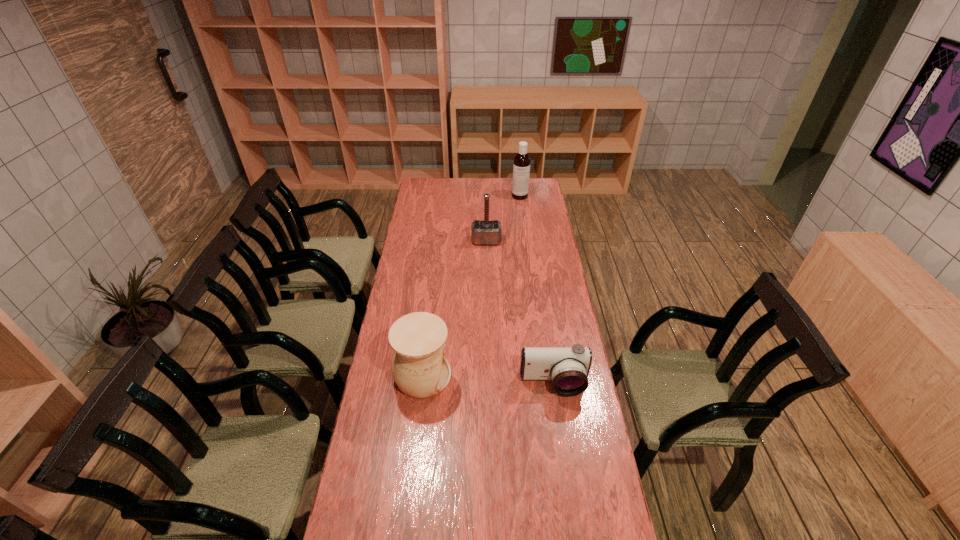
You are a GUI agent. You are given a task and a screenshot of the screen. Output one action in this format:
    pyautogui.click(x=<x>, y=<y>)
    Task: Click on the dishwasher detergent
    Image resolution: width=960 pixels, height=540 pixels.
    Given the screenshot: What is the action you would take?
    pyautogui.click(x=521, y=168)

Locate an element on the screen. The width and height of the screenshot is (960, 540). the farthest object is located at coordinates (521, 168).

Where is `hammer`? hammer is located at coordinates (485, 232).

Locate an element on the screen. This screenshot has height=540, width=960. the third object from right to left is located at coordinates (485, 232).

Find the location of a particular element. The image size is (960, 540). pottery is located at coordinates (420, 368).

Locate an element on the screen. the third tallest object is located at coordinates (420, 368).

Locate an element on the screen. This screenshot has height=540, width=960. camcorder is located at coordinates (568, 367).

Where is `free space located on the label side of the tallest object`? The height and width of the screenshot is (540, 960). free space located on the label side of the tallest object is located at coordinates (524, 226).

This screenshot has width=960, height=540. Find the location of `free spot located on the right of the second object from left to right`. free spot located on the right of the second object from left to right is located at coordinates (543, 241).

The height and width of the screenshot is (540, 960). Find the location of `vacant space situated at the open side of the leftmost object`. vacant space situated at the open side of the leftmost object is located at coordinates (502, 376).